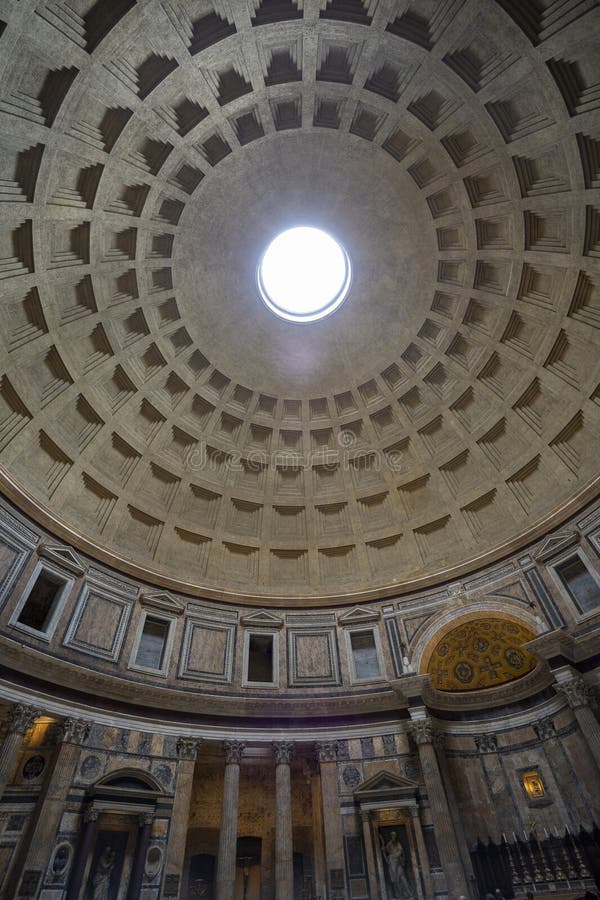
At what (x,y) coordinates should I click in order to perform the action: click on statue. Please return your answer as a coordinate pair (x, y). The image size is (600, 900). Looking at the image, I should click on (x=399, y=862), (x=105, y=868).